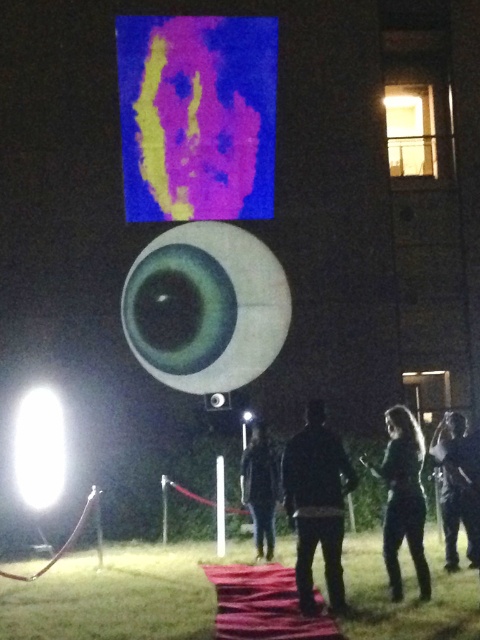
You are a photographer standing on the red carpet in front of the projection screen. You want to take a photo that includes both the dark gray hoodie at center and the dark fabric jacket at center. The camera you are using has a maximum focus range of 2 meters. Will both subjects be in focus if you position yourself exactly between them?

The distance between the dark gray hoodie at center and the dark fabric jacket at center is 1.96 meters. Since the camera can focus up to 2 meters, positioning yourself exactly between them means each subject is 0.98 meters away from the camera. This distance is within the focus range, so both subjects will be in focus.